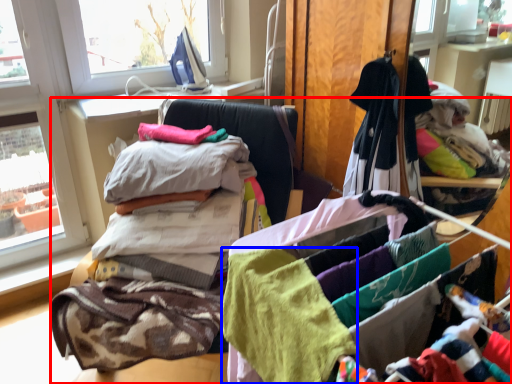
Question: Which point is further to the camera, furniture (highlighted by a red box) or baby clothe (highlighted by a blue box)?

Choices:
 (A) furniture
 (B) baby clothe

Answer: (A)